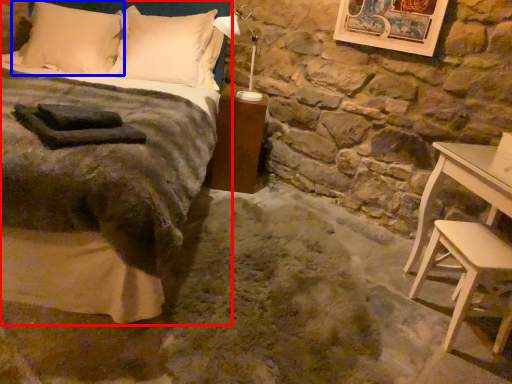
Question: Which object appears closest to the camera in this image, bed (highlighted by a red box) or pillow (highlighted by a blue box)?

Choices:
 (A) bed
 (B) pillow

Answer: (A)